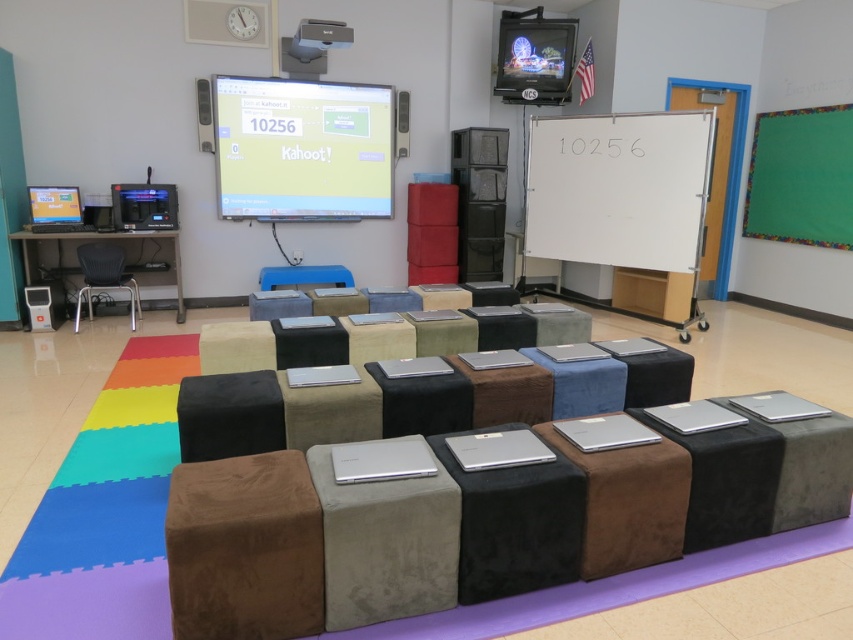
Question: Does brown suede stool at lower left have a larger size compared to metallic gray chair at left?

Choices:
 (A) no
 (B) yes

Answer: (A)

Question: In this image, where is matte plastic projector screen at upper center located relative to matte black projector at upper center?

Choices:
 (A) left
 (B) right

Answer: (A)

Question: Considering the real-world distances, which object is farthest from the matte black projector at upper center?

Choices:
 (A) white matte whiteboard at center
 (B) metallic gray chair at left
 (C) matte plastic projector screen at upper center
 (D) brown suede stool at lower left

Answer: (D)

Question: Which point is farther from the camera taking this photo?

Choices:
 (A) (328, 26)
 (B) (851, 124)
 (C) (213, 157)

Answer: (C)

Question: Among these points, which one is nearest to the camera?

Choices:
 (A) (604, 189)
 (B) (329, 122)
 (C) (111, 272)
 (D) (798, 234)

Answer: (C)

Question: Does brown suede stool at lower left appear over metallic gray chair at left?

Choices:
 (A) no
 (B) yes

Answer: (A)